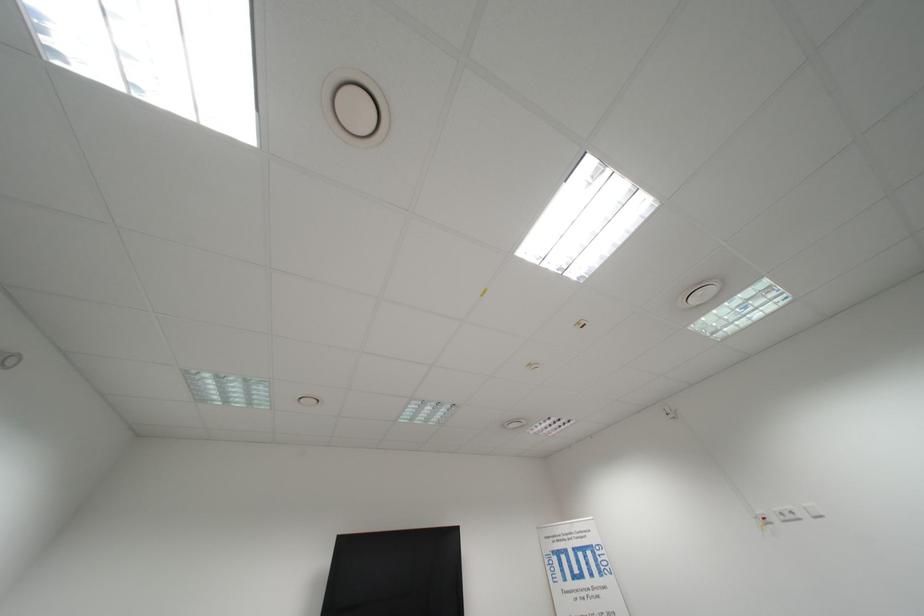
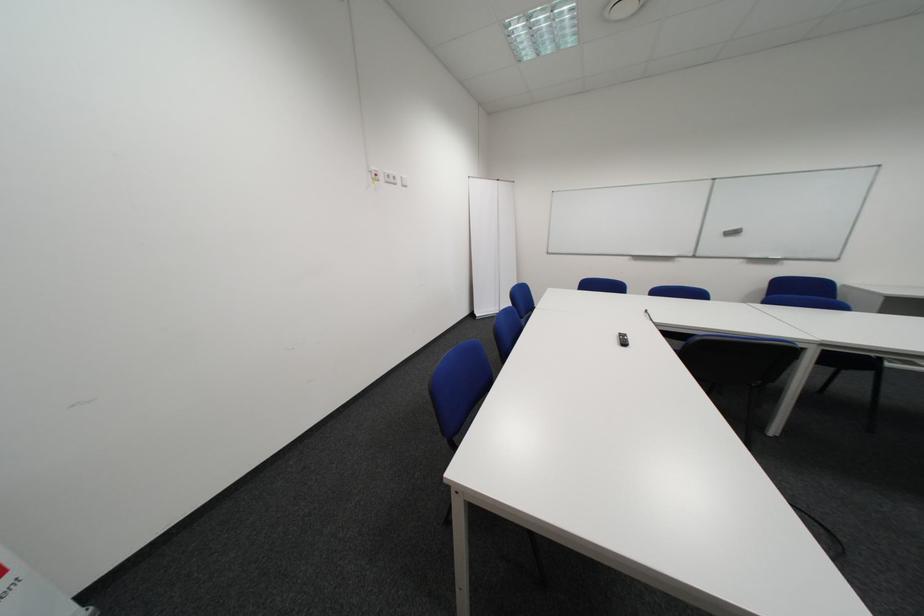
Where in the second image is the point corresponding to the point at 796,519 from the first image?

(398, 180)